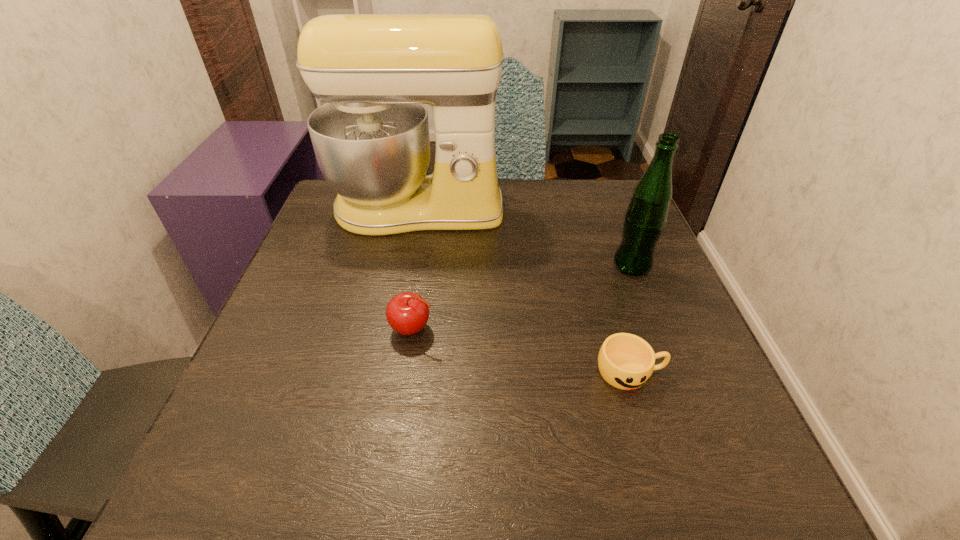
Locate an element on the screen. The height and width of the screenshot is (540, 960). blank space located 0.150m on the front of the second nearest object is located at coordinates (399, 419).

This screenshot has width=960, height=540. I want to click on vacant space situated on the left of the shortest object, so click(x=469, y=372).

The image size is (960, 540). I want to click on object that is at the far edge, so click(371, 139).

Identify the location of object that is positioned at the left edge. The width and height of the screenshot is (960, 540). (371, 139).

Locate an element on the screen. This screenshot has width=960, height=540. beer bottle present at the right edge is located at coordinates tap(646, 216).

Where is `cup situated at the right edge`? This screenshot has height=540, width=960. cup situated at the right edge is located at coordinates (626, 361).

The width and height of the screenshot is (960, 540). In order to click on object that is at the far left corner in this screenshot , I will do `click(371, 139)`.

You are a GUI agent. You are given a task and a screenshot of the screen. Output one action in this format:
    pyautogui.click(x=<x>, y=<y>)
    Task: Click on the vacant space at the far edge of the desktop
    
    Given the screenshot: What is the action you would take?
    pyautogui.click(x=545, y=180)

At what (x,y) coordinates should I click in order to perform the action: click on vacant space at the near edge of the desktop. Please return your answer as a coordinate pair (x, y). The height and width of the screenshot is (540, 960). Looking at the image, I should click on (355, 503).

Find the location of a particular element. Image resolution: width=960 pixels, height=540 pixels. blank space at the left edge of the desktop is located at coordinates (314, 251).